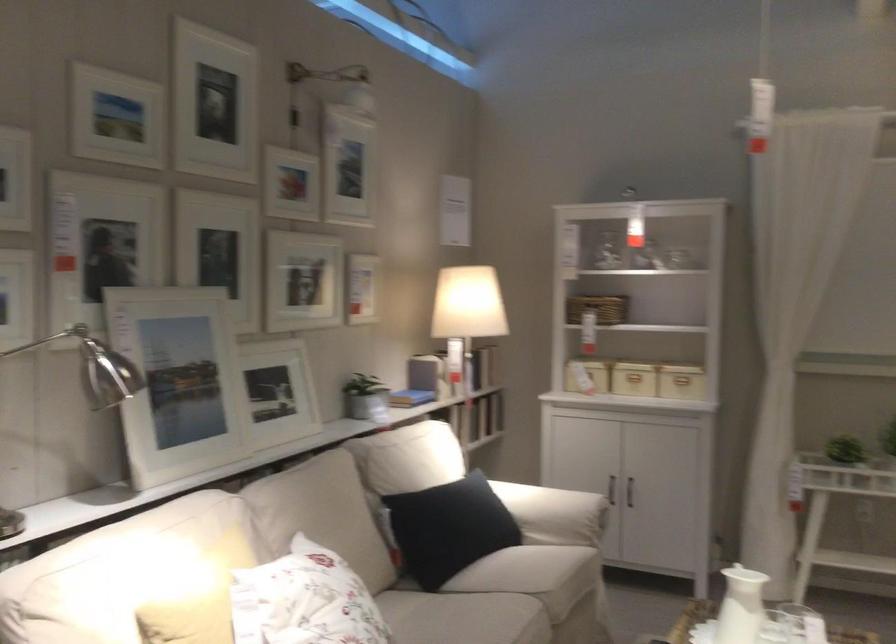
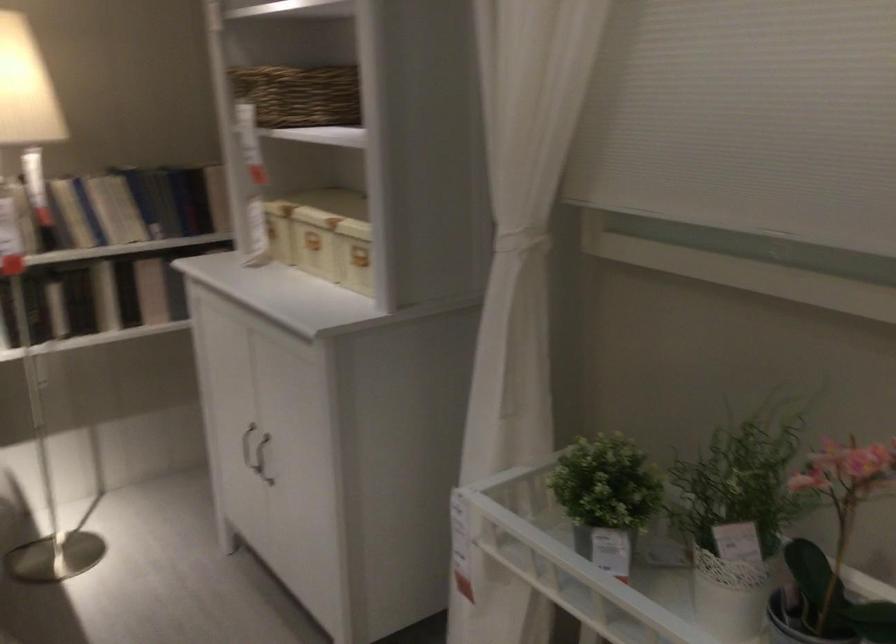
The images are taken continuously from a first-person perspective. In which direction are you moving?

The cameraman walked toward right, forward.